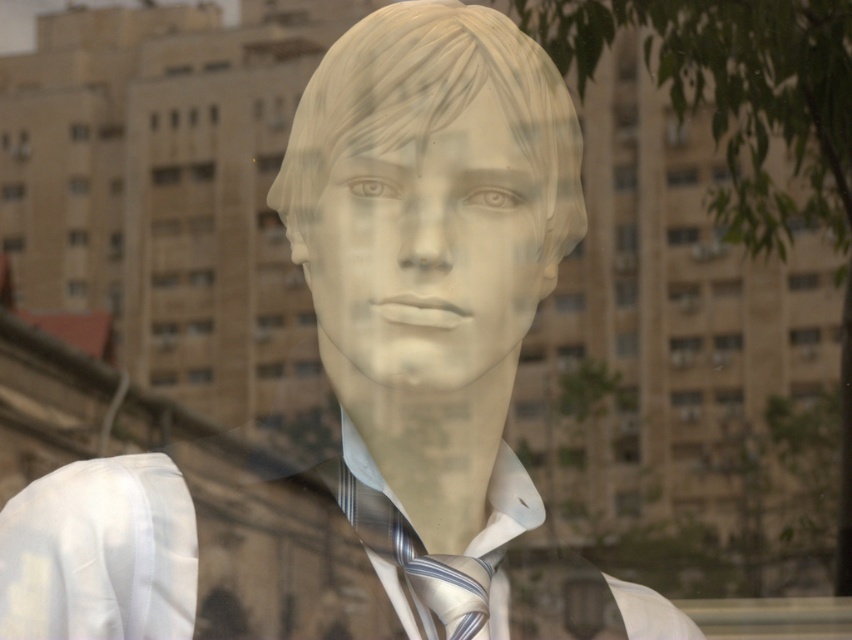
Question: Among these points, which one is nearest to the camera?

Choices:
 (A) (412, 580)
 (B) (430, 316)
 (C) (499, 486)
 (D) (435, 220)

Answer: (D)

Question: Is white silk dress shirt at center closer to camera compared to striped silk tie at center?

Choices:
 (A) no
 (B) yes

Answer: (A)

Question: Can you confirm if white matte mannequin head at center is positioned above white silk dress shirt at center?

Choices:
 (A) no
 (B) yes

Answer: (B)

Question: Which of these objects is positioned closest to the matte white mannequin head at center?

Choices:
 (A) white matte mannequin head at center
 (B) striped silk tie at center
 (C) white silk dress shirt at center

Answer: (A)

Question: Does matte white mannequin head at center have a greater width compared to white matte mannequin head at center?

Choices:
 (A) yes
 (B) no

Answer: (A)

Question: Which of the following is the farthest from the observer?

Choices:
 (A) (482, 577)
 (B) (486, 522)
 (C) (370, 376)

Answer: (B)